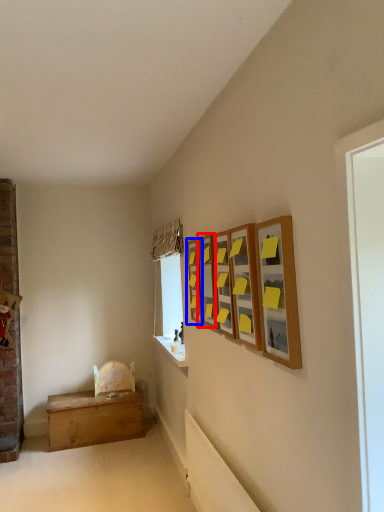
Question: Which point is further to the camera, picture frame (highlighted by a red box) or picture frame (highlighted by a blue box)?

Choices:
 (A) picture frame
 (B) picture frame

Answer: (B)